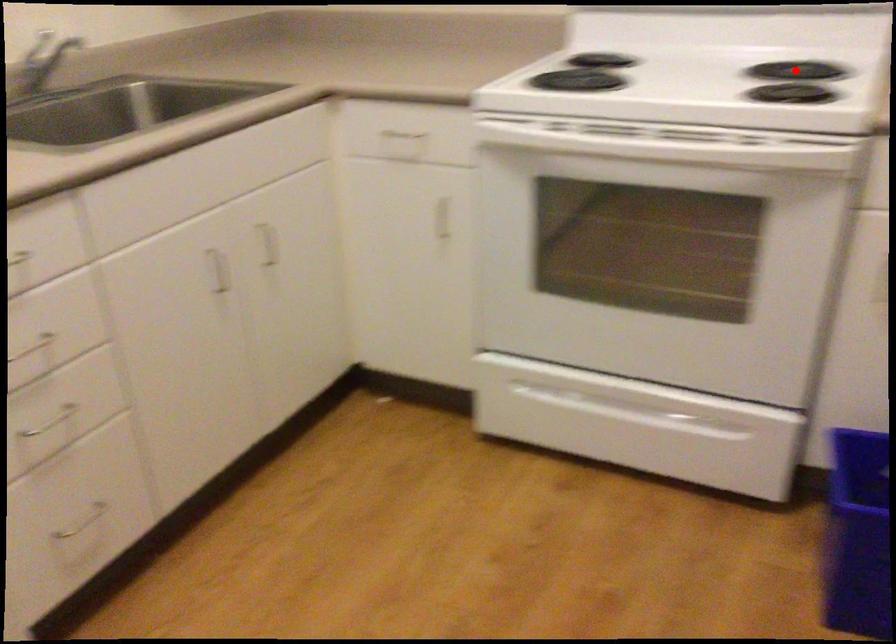
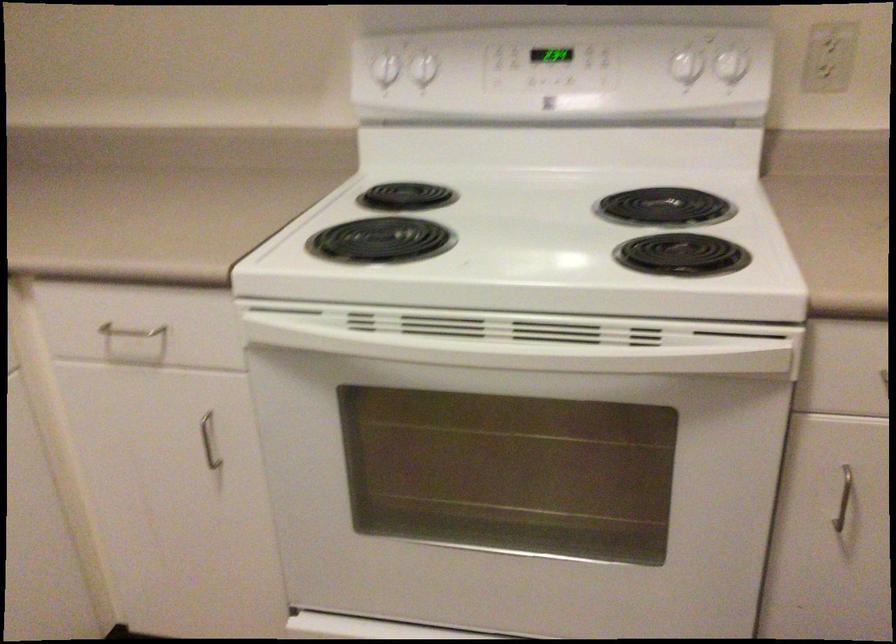
Where in the second image is the point corresponding to the highlighted location from the first image?

(664, 207)